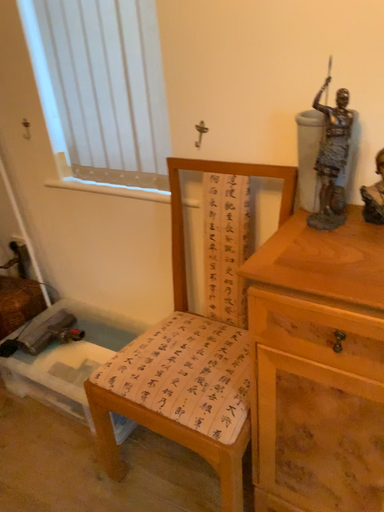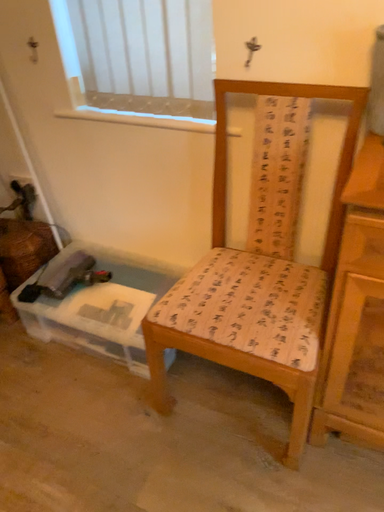
Question: Which way did the camera rotate in the video?

Choices:
 (A) rotated downward
 (B) rotated upward

Answer: (A)